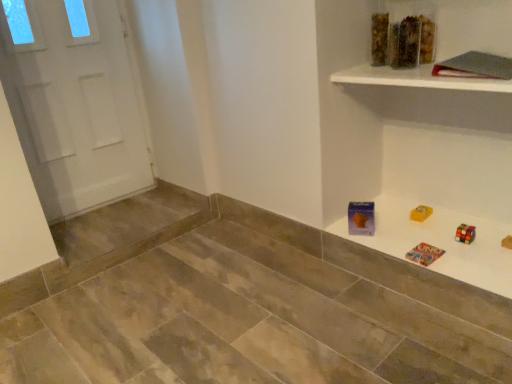
Find the location of a particular element. The image size is (512, 384). blank space to the left of translucent plastic container at upper right, positioned as the 2th toy in right-to-left order is located at coordinates (359, 67).